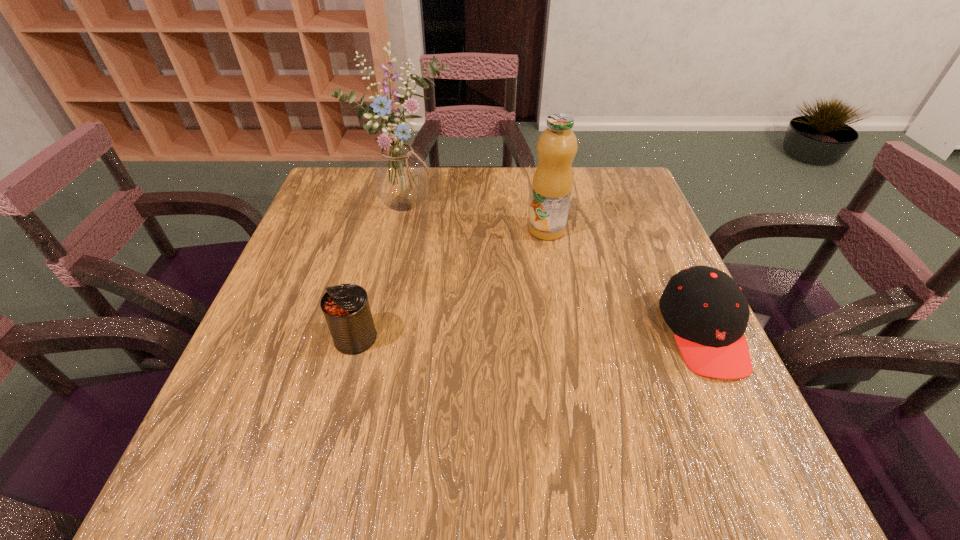
The width and height of the screenshot is (960, 540). Identify the location of the third tallest object. (346, 308).

This screenshot has width=960, height=540. Identify the location of the rightmost object. (707, 311).

Locate an element on the screen. The width and height of the screenshot is (960, 540). the shortest object is located at coordinates pyautogui.click(x=707, y=311).

Find the location of a particular element. bouquet is located at coordinates (399, 174).

Where is `the third object from left to right`? This screenshot has height=540, width=960. the third object from left to right is located at coordinates (557, 146).

Locate an element on the screen. The image size is (960, 540). the second tallest object is located at coordinates (557, 146).

Image resolution: width=960 pixels, height=540 pixels. In order to click on free spot located on the left of the can in this screenshot , I will do `click(278, 338)`.

Identify the location of free space located 0.070m on the front-facing side of the shortest object. (743, 418).

Where is `blank area located on the front-facing side of the tallest object`? Image resolution: width=960 pixels, height=540 pixels. blank area located on the front-facing side of the tallest object is located at coordinates (505, 300).

The image size is (960, 540). I want to click on blank space located 0.300m on the front-facing side of the tallest object, so click(x=496, y=291).